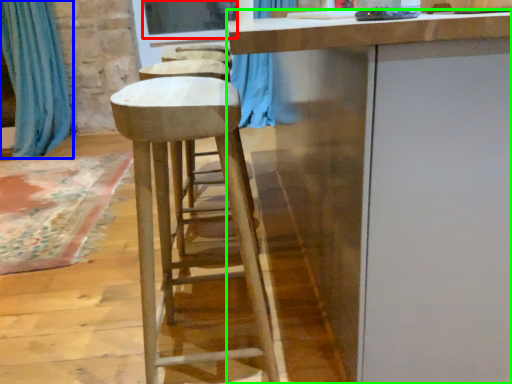
Question: Considering the real-world distances, which object is farthest from window screen (highlighted by a red box)? curtain (highlighted by a blue box) or cabinetry (highlighted by a green box)?

Choices:
 (A) curtain
 (B) cabinetry

Answer: (B)